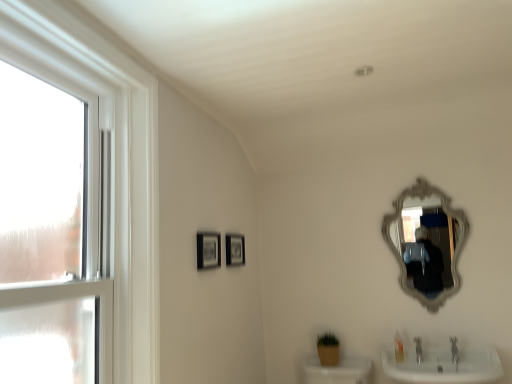
Question: Would you consider clear glass window at left to be distant from matte black picture frame at center, which ranks as the 2th picture frame in front-to-back order?

Choices:
 (A) no
 (B) yes

Answer: (B)

Question: From the image's perspective, is clear glass window at left below matte black picture frame at center, the 1th picture frame when ordered from right to left?

Choices:
 (A) no
 (B) yes

Answer: (A)

Question: Is clear glass window at left positioned beyond the bounds of matte black picture frame at center, the 2th picture frame viewed from the left?

Choices:
 (A) yes
 (B) no

Answer: (A)

Question: Is clear glass window at left bigger than matte black picture frame at center, the 2th picture frame viewed from the left?

Choices:
 (A) yes
 (B) no

Answer: (A)

Question: Does clear glass window at left contain matte black picture frame at center, which ranks as the 2th picture frame in front-to-back order?

Choices:
 (A) yes
 (B) no

Answer: (B)

Question: Is point (203, 258) positioned closer to the camera than point (437, 299)?

Choices:
 (A) farther
 (B) closer

Answer: (B)

Question: In terms of width, does matte black picture frame at center, which ranks as the first picture frame in left-to-right order, look wider or thinner when compared to silver/gilded ornate mirror at upper right?

Choices:
 (A) thin
 (B) wide

Answer: (A)

Question: From the image's perspective, is matte black picture frame at center, which ranks as the first picture frame in left-to-right order, located above or below silver/gilded ornate mirror at upper right?

Choices:
 (A) above
 (B) below

Answer: (A)

Question: From a real-world perspective, is matte black picture frame at center, placed as the 2th picture frame when sorted from back to front, positioned above or below silver/gilded ornate mirror at upper right?

Choices:
 (A) below
 (B) above

Answer: (B)

Question: From a real-world perspective, is silver/gilded ornate mirror at upper right positioned above or below matte black picture frame at center, which ranks as the 2th picture frame in right-to-left order?

Choices:
 (A) below
 (B) above

Answer: (A)

Question: Considering the relative positions of silver/gilded ornate mirror at upper right and matte black picture frame at center, which ranks as the 2th picture frame in right-to-left order, in the image provided, is silver/gilded ornate mirror at upper right to the left or to the right of matte black picture frame at center, which ranks as the 2th picture frame in right-to-left order,?

Choices:
 (A) left
 (B) right

Answer: (B)

Question: Is point (389, 223) closer or farther from the camera than point (219, 243)?

Choices:
 (A) farther
 (B) closer

Answer: (A)

Question: From the image's perspective, is silver/gilded ornate mirror at upper right above or below matte black picture frame at center, placed as the 2th picture frame when sorted from back to front?

Choices:
 (A) above
 (B) below

Answer: (B)

Question: From a real-world perspective, is translucent plastic soap at lower right above or below clear glass window at left?

Choices:
 (A) below
 (B) above

Answer: (A)

Question: Is translucent plastic soap at lower right spatially inside clear glass window at left, or outside of it?

Choices:
 (A) inside
 (B) outside

Answer: (B)